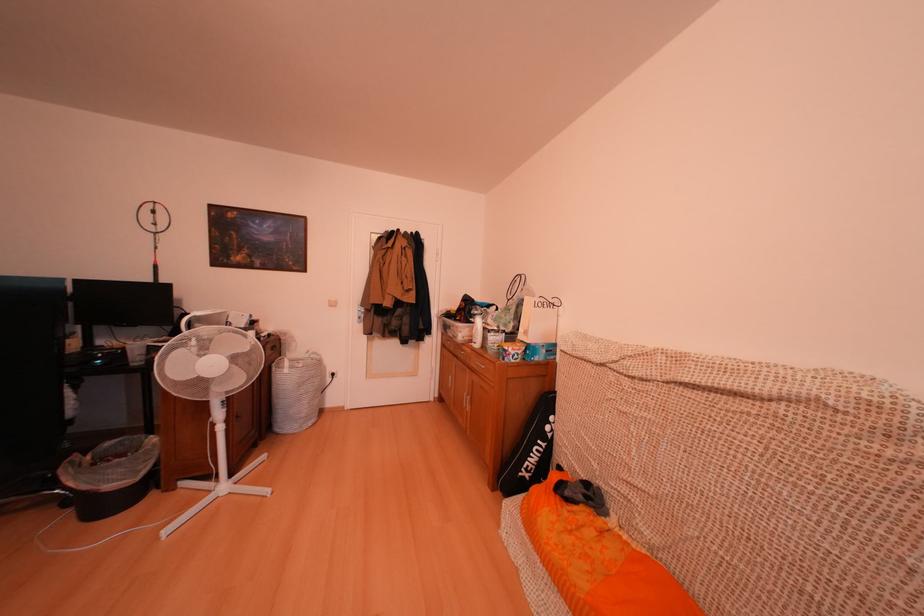
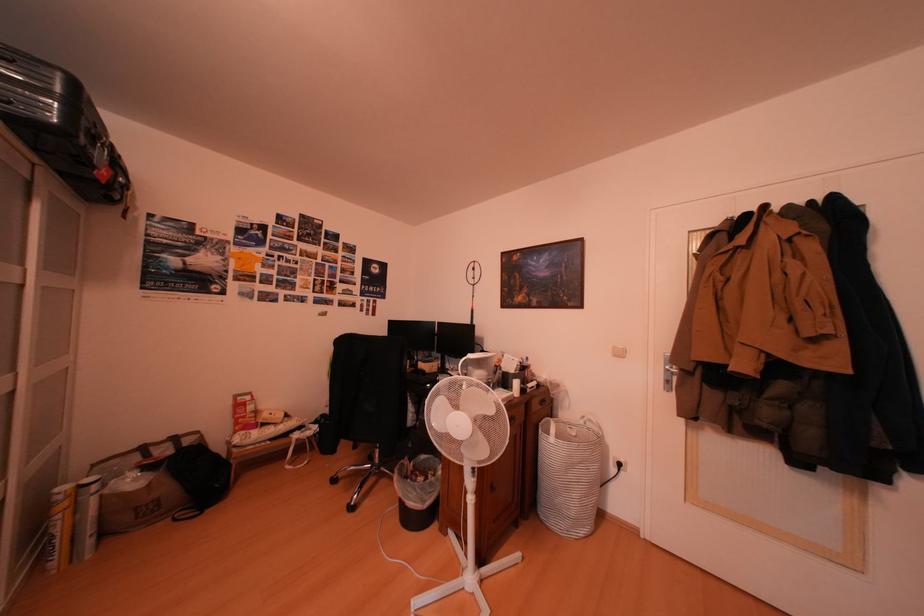
Question: The images are taken continuously from a first-person perspective. In which direction is your viewpoint rotating?

Choices:
 (A) Left
 (B) Right
 (C) Up
 (D) Down

Answer: (A)